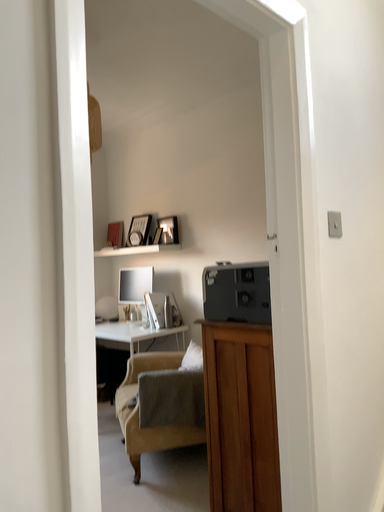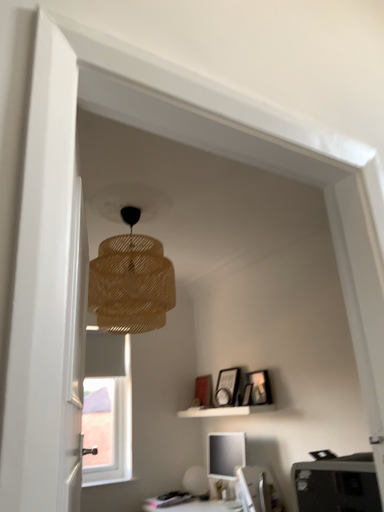
Question: How did the camera likely rotate when shooting the video?

Choices:
 (A) rotated upward
 (B) rotated downward

Answer: (A)